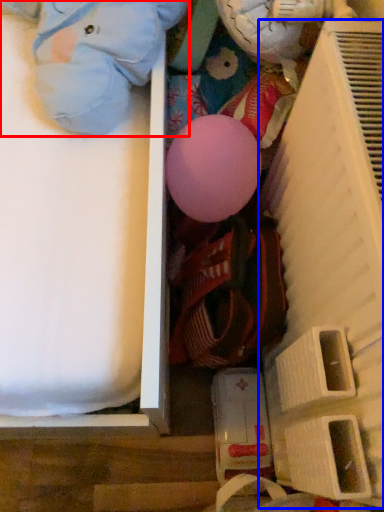
Question: Among these objects, which one is nearest to the camera, toy (highlighted by a red box) or shelf (highlighted by a blue box)?

Choices:
 (A) toy
 (B) shelf

Answer: (B)